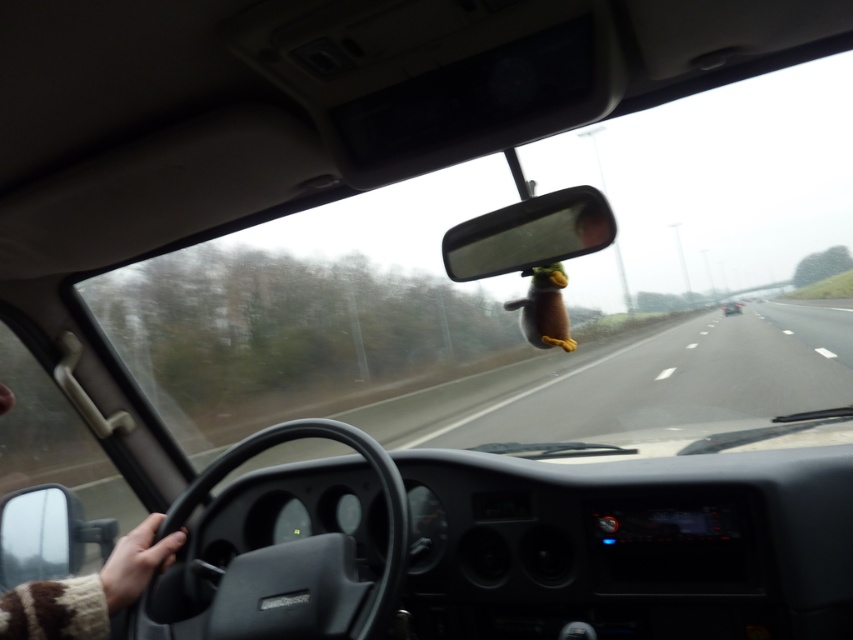
You are sitting in the driver seat of the vehicle. You see two points marked on the windshield. Which point is closer to you, point (602,234) or point (728,314)?

Point (602,234) is in front of point (728,314), so it is closer to you.

You are sitting in the driver seat of the car shown in the image. There are two points marked in the scene. The first point is at coordinate point (x=234, y=282) and the second is at point (x=569, y=192). Which point is closer to you?

Point (x=234, y=282) is further to the camera than point (x=569, y=192), so the point closer to you is point (x=569, y=192).